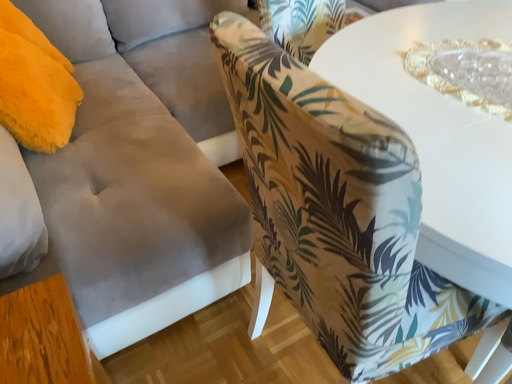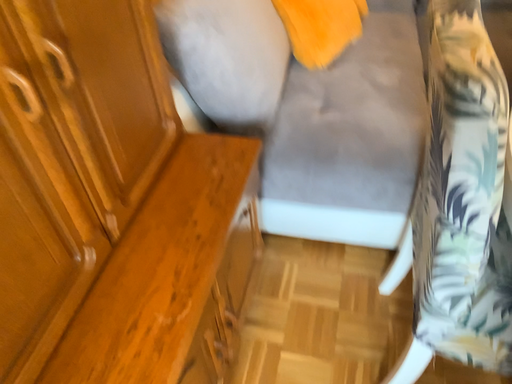
Question: Which way did the camera rotate in the video?

Choices:
 (A) rotated left
 (B) rotated right

Answer: (A)